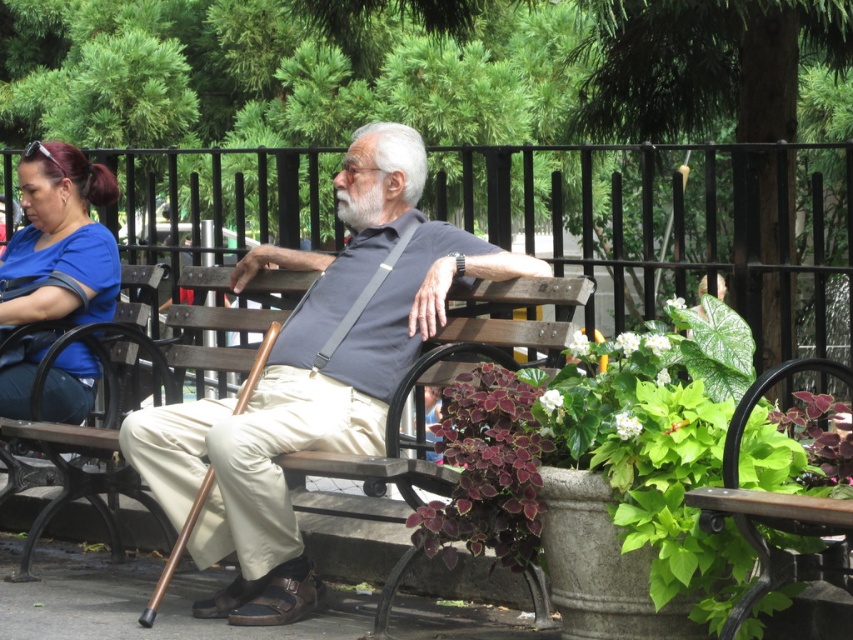
Question: Can you confirm if green leafy plant at lower right is wider than purple leafy plant at lower center?

Choices:
 (A) yes
 (B) no

Answer: (A)

Question: Which point is closer to the camera taking this photo?

Choices:
 (A) (206, 512)
 (B) (518, 502)
 (C) (44, 388)

Answer: (B)

Question: Is green leafy plant at lower right to the left of purple leafy plant at lower center from the viewer's perspective?

Choices:
 (A) no
 (B) yes

Answer: (A)

Question: From the image, what is the correct spatial relationship of purple leafy plant at lower center in relation to brown wood bench at left?

Choices:
 (A) left
 (B) right

Answer: (B)

Question: Which point is farther from the camera taking this photo?

Choices:
 (A) tap(395, 346)
 (B) tap(82, 456)
 (C) tap(560, 461)

Answer: (B)

Question: Which point is closer to the camera?

Choices:
 (A) (48, 513)
 (B) (477, 406)
 (C) (563, 396)

Answer: (C)